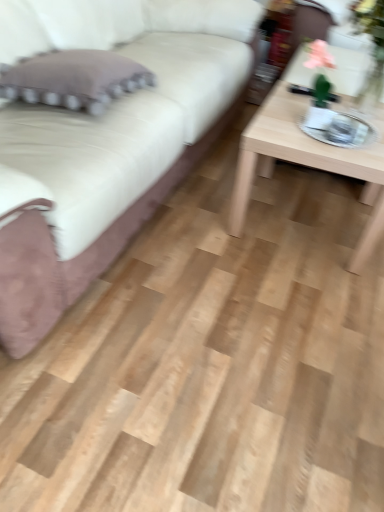
Image resolution: width=384 pixels, height=512 pixels. What do you see at coordinates (307, 162) in the screenshot?
I see `light wood/texture coffee table at right` at bounding box center [307, 162].

Describe the element at coordinates (74, 79) in the screenshot. I see `purple fabric pillow at left` at that location.

Find the location of a particular element. The height and width of the screenshot is (512, 384). velvet beige couch at upper left is located at coordinates (109, 147).

Considering the sizes of purple fabric pillow at left and velvet beige couch at upper left in the image, is purple fabric pillow at left taller or shorter than velvet beige couch at upper left?

Considering their sizes, purple fabric pillow at left has less height than velvet beige couch at upper left.

Considering the relative positions of purple fabric pillow at left and velvet beige couch at upper left in the image provided, is purple fabric pillow at left in front of velvet beige couch at upper left?

No, the depth of purple fabric pillow at left is greater than that of velvet beige couch at upper left.

From a real-world perspective, which object rests below the other?

In real-world perspective, velvet beige couch at upper left is lower.

Are purple fabric pillow at left and velvet beige couch at upper left beside each other?

purple fabric pillow at left and velvet beige couch at upper left are not in contact.

From the picture: Is light wood/texture coffee table at right looking in the opposite direction of purple fabric pillow at left?

Yes, light wood/texture coffee table at right is facing away from purple fabric pillow at left.

Considering the positions of objects light wood/texture coffee table at right and purple fabric pillow at left in the image provided, who is more to the left, light wood/texture coffee table at right or purple fabric pillow at left?

Positioned to the left is purple fabric pillow at left.

Is light wood/texture coffee table at right inside the boundaries of purple fabric pillow at left, or outside?

light wood/texture coffee table at right is spatially situated outside purple fabric pillow at left.

Can light wood/texture coffee table at right be found inside purple fabric pillow at left?

Definitely not — light wood/texture coffee table at right is not inside purple fabric pillow at left.

From a real-world perspective, between purple fabric pillow at left and light wood/texture coffee table at right, who is vertically higher?

purple fabric pillow at left, from a real-world perspective.

Where is `pillow lying above the light wood/texture coffee table at right (from the image's perspective)`? This screenshot has width=384, height=512. pillow lying above the light wood/texture coffee table at right (from the image's perspective) is located at coordinates (74, 79).

Between purple fabric pillow at left and light wood/texture coffee table at right, which one has smaller size?

purple fabric pillow at left.

Could you tell me if light wood/texture coffee table at right is facing velvet beige couch at upper left?

No, light wood/texture coffee table at right is not aimed at velvet beige couch at upper left.

Does light wood/texture coffee table at right have a smaller size compared to velvet beige couch at upper left?

Yes, light wood/texture coffee table at right is smaller than velvet beige couch at upper left.

Is light wood/texture coffee table at right not within velvet beige couch at upper left?

Answer: Yes.

How far apart are light wood/texture coffee table at right and velvet beige couch at upper left?

light wood/texture coffee table at right is 20.38 inches away from velvet beige couch at upper left.

Who is shorter, velvet beige couch at upper left or purple fabric pillow at left?

Standing shorter between the two is purple fabric pillow at left.

Does point (115, 133) come closer to viewer compared to point (76, 95)?

Yes, it is.

Does velvet beige couch at upper left lie behind purple fabric pillow at left?

No, it is in front of purple fabric pillow at left.

Between velvet beige couch at upper left and light wood/texture coffee table at right, which one has smaller width?

light wood/texture coffee table at right is thinner.

Which is farther from the camera, (2, 4) or (242, 187)?

The point (242, 187) is farther from the camera.

Looking at this image, is velvet beige couch at upper left situated inside light wood/texture coffee table at right or outside?

velvet beige couch at upper left is spatially situated outside light wood/texture coffee table at right.

Based on their positions, is velvet beige couch at upper left located to the left or right of light wood/texture coffee table at right?

Clearly, velvet beige couch at upper left is on the left of light wood/texture coffee table at right in the image.

What are the coordinates of `studio couch located in front of the purple fabric pillow at left` in the screenshot? It's located at (109, 147).

At what (x,y) coordinates should I click in order to perform the action: click on pillow that is above the light wood/texture coffee table at right (from a real-world perspective). Please return your answer as a coordinate pair (x, y). Looking at the image, I should click on (74, 79).

Which object lies nearer to the anchor point light wood/texture coffee table at right, velvet beige couch at upper left or purple fabric pillow at left?

Among the two, velvet beige couch at upper left is located nearer to light wood/texture coffee table at right.

Looking at the image, which one is located closer to purple fabric pillow at left, light wood/texture coffee table at right or velvet beige couch at upper left?

velvet beige couch at upper left lies closer to purple fabric pillow at left than the other object.

From the image, which object appears to be nearer to velvet beige couch at upper left, light wood/texture coffee table at right or purple fabric pillow at left?

purple fabric pillow at left.

When comparing their distances from velvet beige couch at upper left, does purple fabric pillow at left or light wood/texture coffee table at right seem closer?

purple fabric pillow at left is closer to velvet beige couch at upper left.

Which object lies further to the anchor point purple fabric pillow at left, velvet beige couch at upper left or light wood/texture coffee table at right?

Based on the image, light wood/texture coffee table at right appears to be further to purple fabric pillow at left.

When comparing their distances from light wood/texture coffee table at right, does purple fabric pillow at left or velvet beige couch at upper left seem closer?

velvet beige couch at upper left lies closer to light wood/texture coffee table at right than the other object.

Image resolution: width=384 pixels, height=512 pixels. In order to click on pillow between velvet beige couch at upper left and light wood/texture coffee table at right from left to right in this screenshot , I will do `click(74, 79)`.